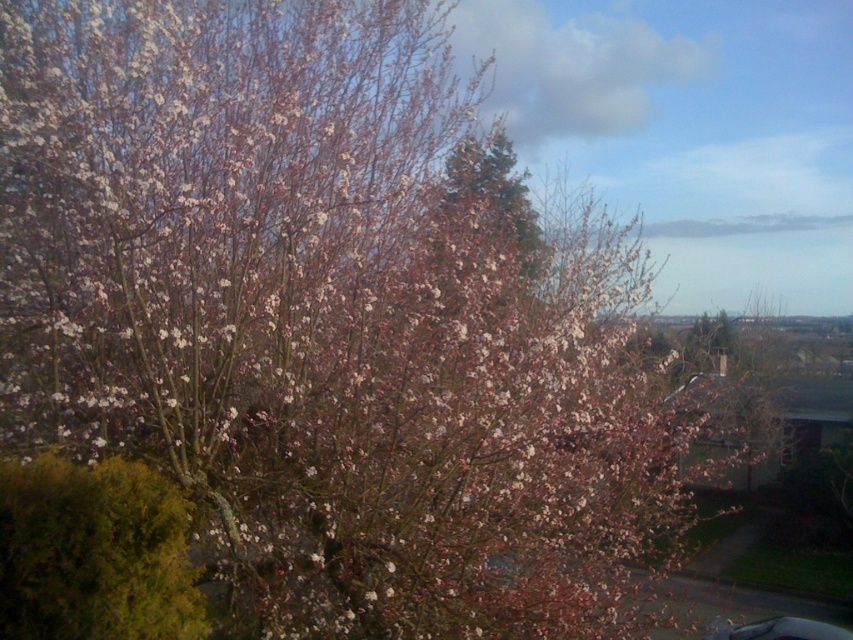
Consider the image. You are standing in the garden and see the point marked at coordinates (94, 554). What object is located at that point?

The point at coordinates (94, 554) marks the green mossy bush at lower left.

You are standing at the center of the image. Which direction should you move to reach the green mossy bush at lower left?

You should move to the lower left direction to reach the green mossy bush at lower left.

A gardener wants to plant a new shrub that requires at least 15 feet of space between it and the green mossy bush at lower left. If the gardener places the new shrub exactly where the residential structures are partially visible to the right, will there be enough space?

The distance between the green mossy bush at lower left and the residential structures to the right is 16.17 feet, which is more than the required 15 feet. Therefore, there is enough space.